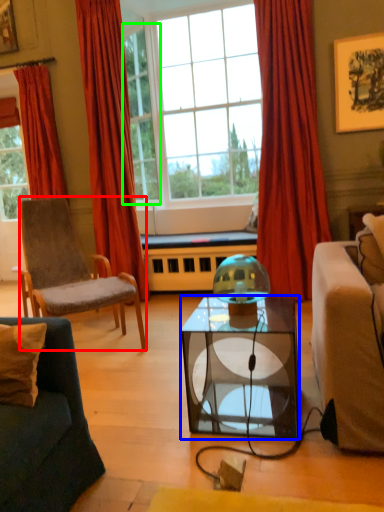
Question: Based on their relative distances, which object is farther from chair (highlighted by a red box)? Choose from coffee table (highlighted by a blue box) and window (highlighted by a green box).

Choices:
 (A) coffee table
 (B) window

Answer: (B)